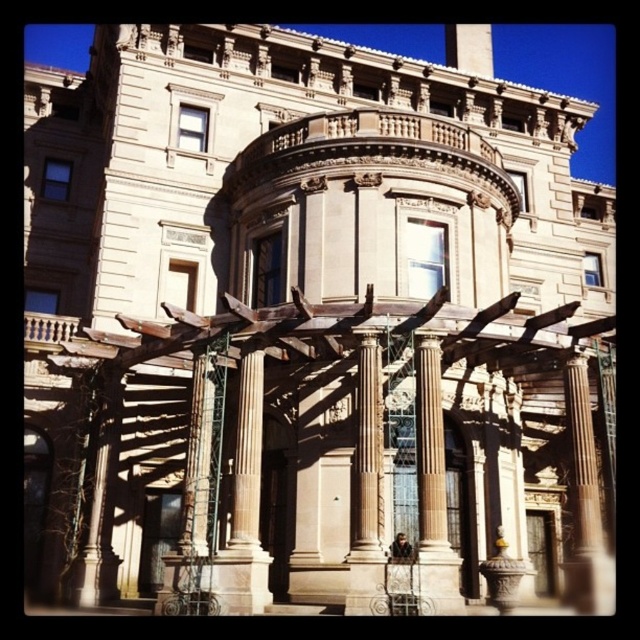
Where is `sandy brown stone column at center`? Image resolution: width=640 pixels, height=640 pixels. sandy brown stone column at center is located at coordinates (433, 486).

Is sandy brown stone column at center in front of sandy brown stone column at lower left?

That is True.

Does point (451, 566) come behind point (109, 374)?

No, (451, 566) is closer to viewer.

At what (x,y) coordinates should I click in order to perform the action: click on sandy brown stone column at center. Please return your answer as a coordinate pair (x, y). The height and width of the screenshot is (640, 640). Looking at the image, I should click on (433, 486).